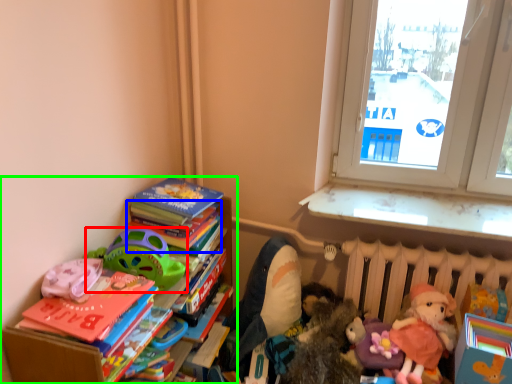
Question: Which is nearer to the toy (highlighted by a red box)? book (highlighted by a blue box) or bookcase (highlighted by a green box).

Choices:
 (A) book
 (B) bookcase

Answer: (A)